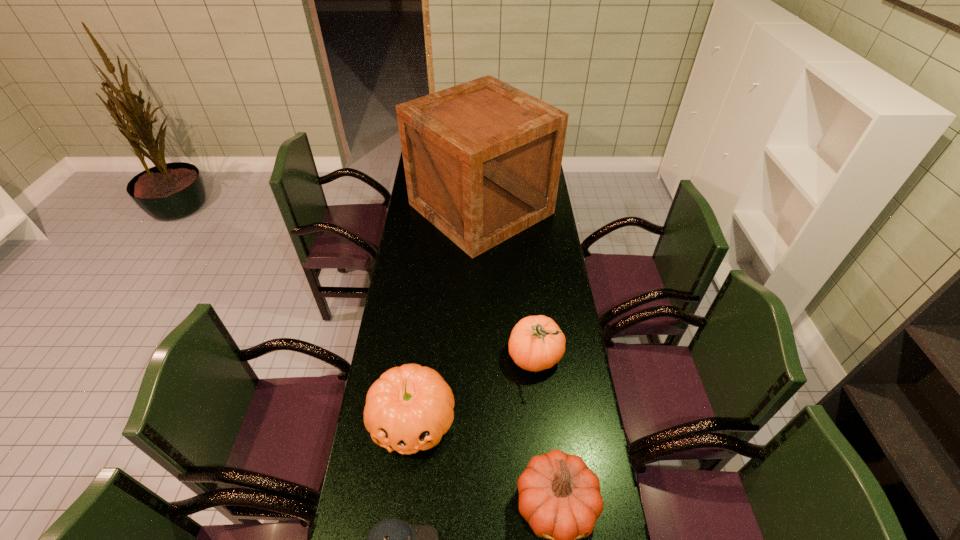
Find the location of a particular element. This screenshot has width=960, height=540. box is located at coordinates (482, 159).

In order to click on the farthest object in this screenshot , I will do `click(482, 159)`.

I want to click on the fourth shortest object, so click(x=536, y=343).

In order to click on the leftmost pumpkin in this screenshot , I will do `click(409, 408)`.

The height and width of the screenshot is (540, 960). Find the location of `vacant region located on the front of the tallest object`. vacant region located on the front of the tallest object is located at coordinates (481, 322).

Image resolution: width=960 pixels, height=540 pixels. I want to click on free point located on the left of the tallest pumpkin, so click(x=486, y=356).

Find the location of a particular element. The height and width of the screenshot is (540, 960). free space located on the carved face of the leftmost pumpkin is located at coordinates (399, 533).

You are a GUI agent. You are given a task and a screenshot of the screen. Output one action in this format:
    pyautogui.click(x=<x>, y=<y>)
    Task: Click on the object that is at the far edge
    This screenshot has height=540, width=960.
    Given the screenshot: What is the action you would take?
    pyautogui.click(x=482, y=159)

At what (x,y) coordinates should I click in order to perform the action: click on box located at the left edge. Please return your answer as a coordinate pair (x, y). This screenshot has width=960, height=540. Looking at the image, I should click on (482, 159).

Where is `pumpkin situated at the left edge`? The image size is (960, 540). pumpkin situated at the left edge is located at coordinates (409, 408).